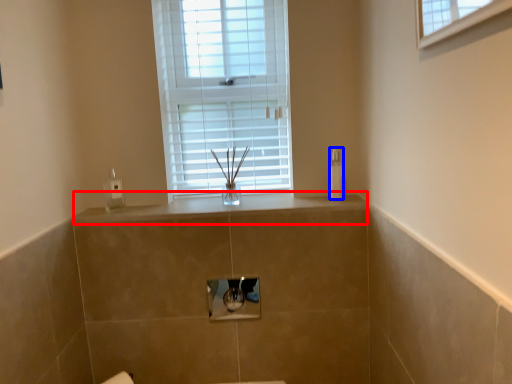
Question: Which object appears farthest to the camera in this image, counter top (highlighted by a red box) or toiletry (highlighted by a blue box)?

Choices:
 (A) counter top
 (B) toiletry

Answer: (B)